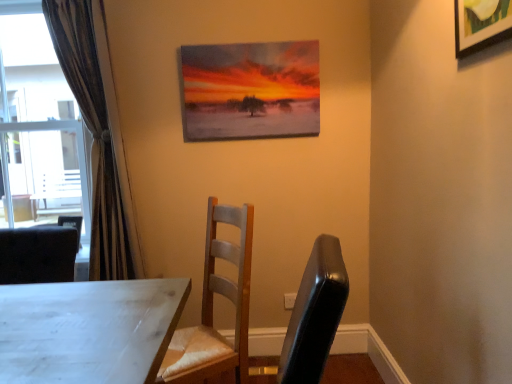
Question: Is oil painting at upper center, the 1th picture frame positioned from the back, bigger or smaller than wooden picture frame at upper right, which is the 2th picture frame from back to front?

Choices:
 (A) small
 (B) big

Answer: (B)

Question: Considering their positions, is oil painting at upper center, the 1th picture frame positioned from the back, located in front of or behind wooden picture frame at upper right, which is the 2th picture frame from back to front?

Choices:
 (A) front
 (B) behind

Answer: (B)

Question: Considering the real-world distances, which object is farthest from the transparent glass window at left?

Choices:
 (A) wooden chair at center
 (B) oil painting at upper center, which is counted as the first picture frame, starting from the left
 (C) wooden picture frame at upper right, which is the 2th picture frame from back to front
 (D) brown textured curtain at left

Answer: (C)

Question: Which of these objects is positioned farthest from the transparent glass window at left?

Choices:
 (A) oil painting at upper center, the 1th picture frame positioned from the back
 (B) wooden chair at center
 (C) wooden picture frame at upper right, which is the 2th picture frame from back to front
 (D) brown textured curtain at left

Answer: (C)